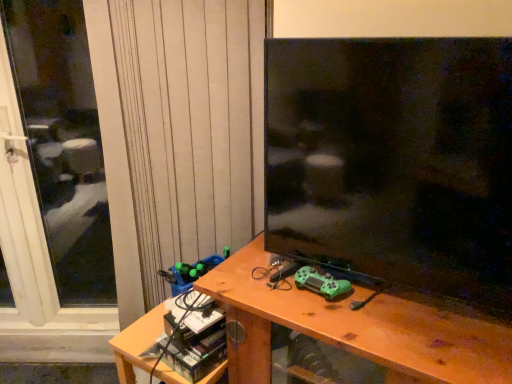
Locate an element on the screen. The image size is (512, 384). empty space that is ontop of wooden desk at center is located at coordinates (367, 304).